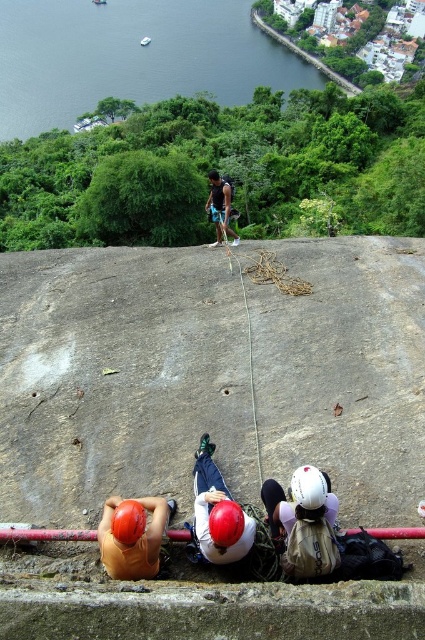
Does green water at upper left lie in front of orange matte helmet at lower left?

No, it is not.

Which is behind, point (59, 10) or point (129, 573)?

The point (59, 10) is more distant.

Is point (51, 26) positioned after point (136, 572)?

Yes, point (51, 26) is farther from viewer.

I want to click on green water at upper left, so click(x=132, y=56).

Is gray rough concrete at center wider than green water at upper left?

No.

Can you confirm if gray rough concrete at center is thinner than green water at upper left?

Indeed, gray rough concrete at center has a lesser width compared to green water at upper left.

The height and width of the screenshot is (640, 425). Describe the element at coordinates (210, 376) in the screenshot. I see `gray rough concrete at center` at that location.

Where is `gray rough concrete at center`? gray rough concrete at center is located at coordinates (210, 376).

Is gray rough concrete at center smaller than orange matte helmet at lower left?

No, gray rough concrete at center is not smaller than orange matte helmet at lower left.

Is gray rough concrete at center to the right of orange matte helmet at lower left from the viewer's perspective?

Correct, you'll find gray rough concrete at center to the right of orange matte helmet at lower left.

Is point (204, 396) behind point (112, 556)?

Yes, it is behind point (112, 556).

Locate an element on the screen. The image size is (425, 640). gray rough concrete at center is located at coordinates (210, 376).